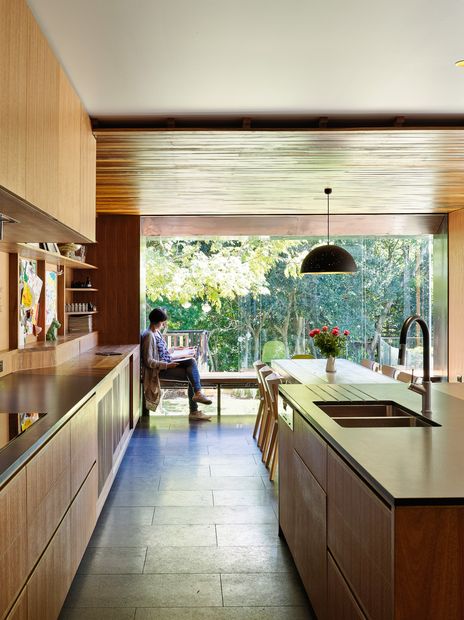
In order to click on sink in this screenshot , I will do `click(383, 423)`.